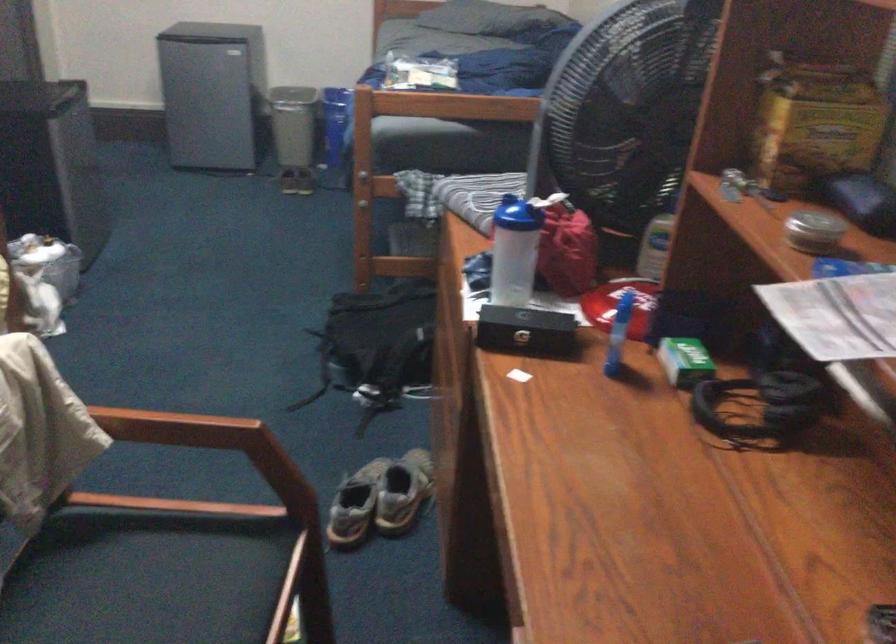
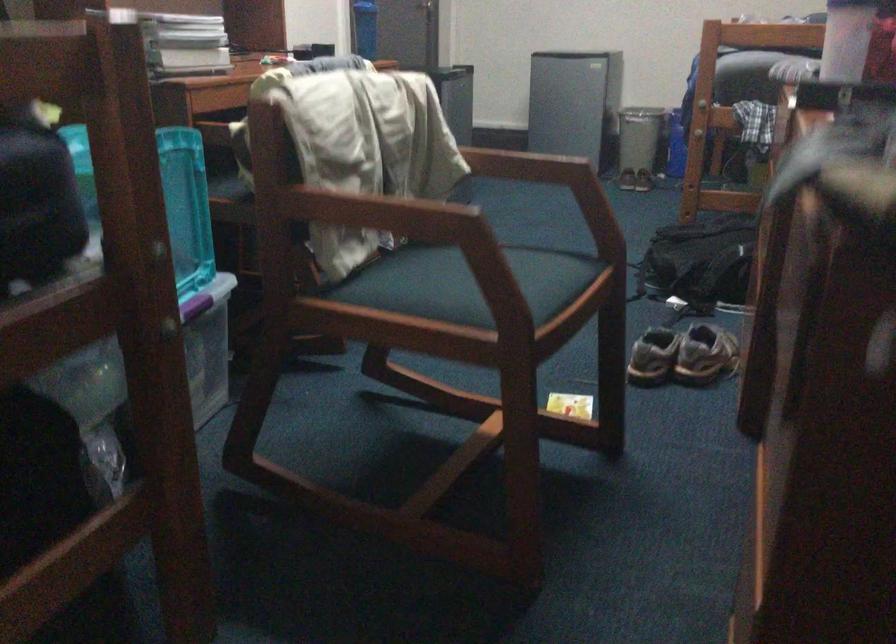
Where in the second image is the point corresponding to the point at 294,147 from the first image?

(638, 146)